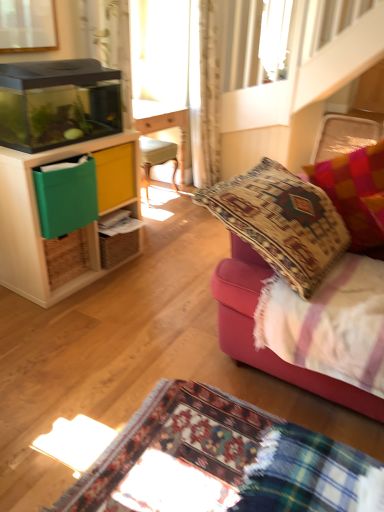
Question: Is velvet cushion at right directly adjacent to light beige textured curtain at upper center?

Choices:
 (A) no
 (B) yes

Answer: (A)

Question: Considering the relative positions of velvet cushion at right and light beige textured curtain at upper center in the image provided, is velvet cushion at right to the left of light beige textured curtain at upper center from the viewer's perspective?

Choices:
 (A) no
 (B) yes

Answer: (A)

Question: Is velvet cushion at right smaller than light beige textured curtain at upper center?

Choices:
 (A) yes
 (B) no

Answer: (B)

Question: Is velvet cushion at right taller than light beige textured curtain at upper center?

Choices:
 (A) no
 (B) yes

Answer: (A)

Question: Could you tell me if velvet cushion at right is facing light beige textured curtain at upper center?

Choices:
 (A) yes
 (B) no

Answer: (B)

Question: Is velvet cushion at right positioned with its back to light beige textured curtain at upper center?

Choices:
 (A) no
 (B) yes

Answer: (A)

Question: Is light beige textured curtain at upper center looking in the opposite direction of velvet cushion at right?

Choices:
 (A) no
 (B) yes

Answer: (A)

Question: From the image's perspective, is light beige textured curtain at upper center on velvet cushion at right?

Choices:
 (A) no
 (B) yes

Answer: (B)

Question: Could you tell me if light beige textured curtain at upper center is turned towards velvet cushion at right?

Choices:
 (A) yes
 (B) no

Answer: (B)

Question: Does light beige textured curtain at upper center lie behind velvet cushion at right?

Choices:
 (A) yes
 (B) no

Answer: (A)

Question: From the image's perspective, is light beige textured curtain at upper center located beneath velvet cushion at right?

Choices:
 (A) yes
 (B) no

Answer: (B)

Question: From a real-world perspective, is light beige textured curtain at upper center physically below velvet cushion at right?

Choices:
 (A) yes
 (B) no

Answer: (B)

Question: Could multicolored woven pillow at right be considered to be inside velvet cushion at right?

Choices:
 (A) yes
 (B) no

Answer: (A)